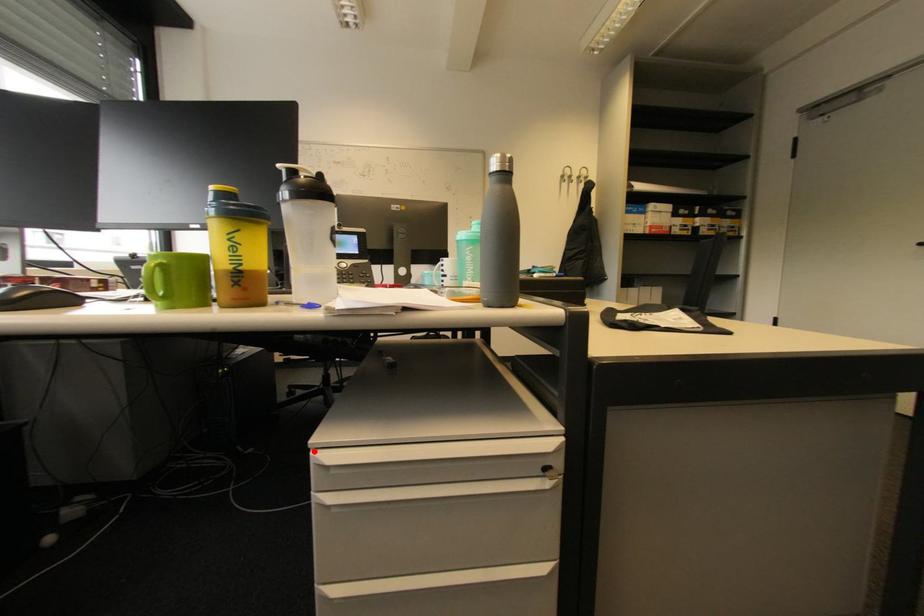
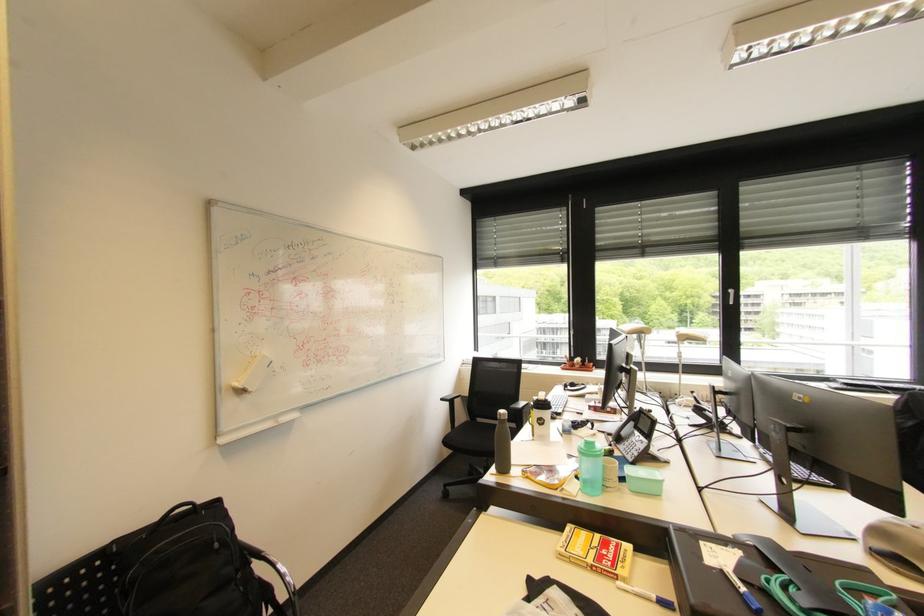
Question: I am providing you with two images of the same scene from different viewpoints. A red point is marked on the first image. Is the red point's position out of view in image 2?

Choices:
 (A) Yes
 (B) No

Answer: (A)